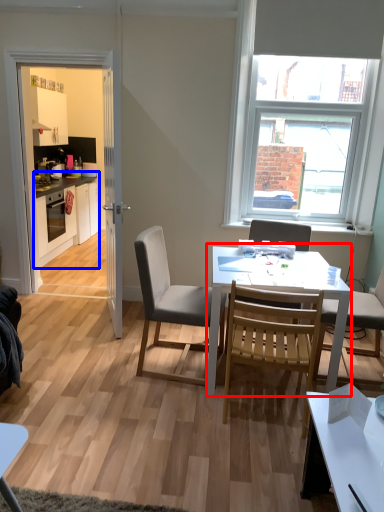
Question: Which object appears closest to the camera in this image, round table (highlighted by a red box) or cabinetry (highlighted by a blue box)?

Choices:
 (A) round table
 (B) cabinetry

Answer: (A)